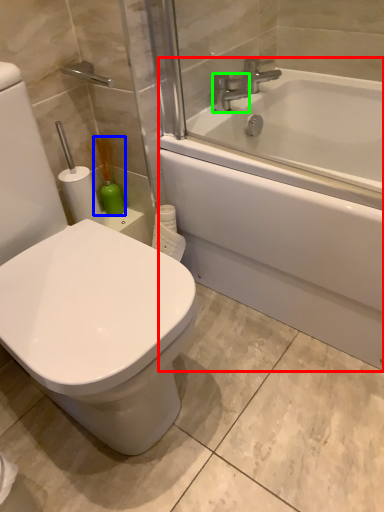
Question: Based on their relative distances, which object is nearer to bathtub (highlighted by a red box)? Choose from soap dispenser (highlighted by a blue box) and faucet (highlighted by a green box).

Choices:
 (A) soap dispenser
 (B) faucet

Answer: (B)